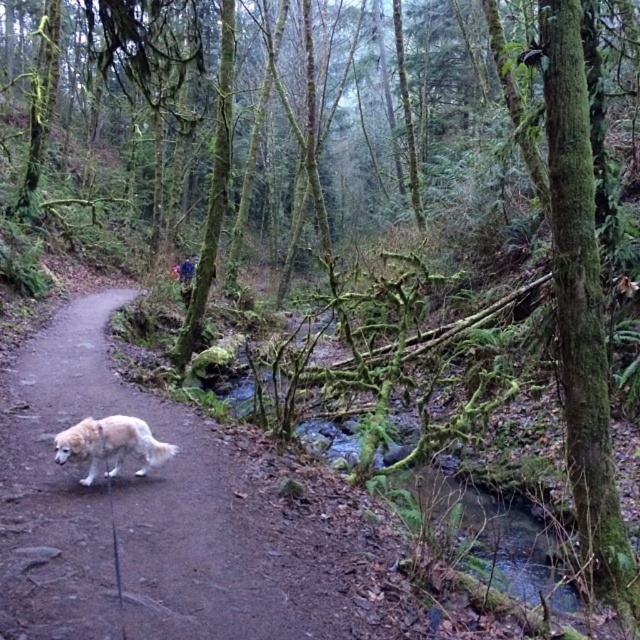
Who is taller, brown dirt path at center or white fluffy dog at lower left?

Standing taller between the two is white fluffy dog at lower left.

Does point (310, 621) lie in front of point (131, 445)?

Yes, it is.

This screenshot has height=640, width=640. Find the location of `brown dirt path at center`. brown dirt path at center is located at coordinates (140, 516).